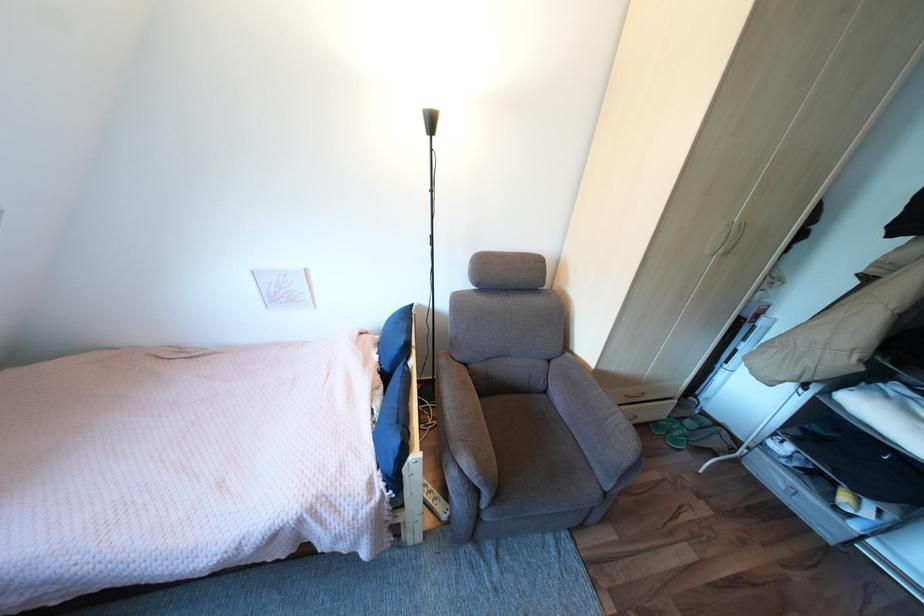
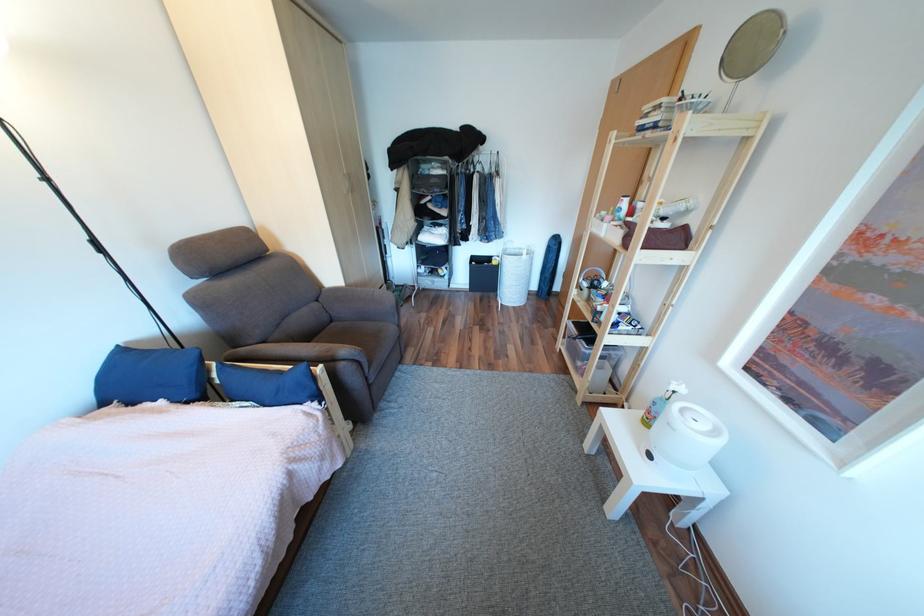
Locate, in the second image, the point that corresponds to (554,395) in the first image.

(344, 323)